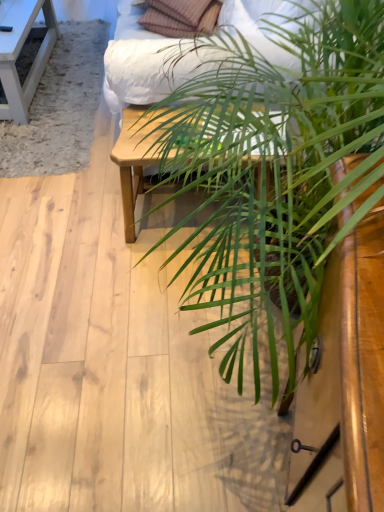
Identify the location of vacant region to the left of light wood table at center, the first table when ordered from bottom to top. (88, 222).